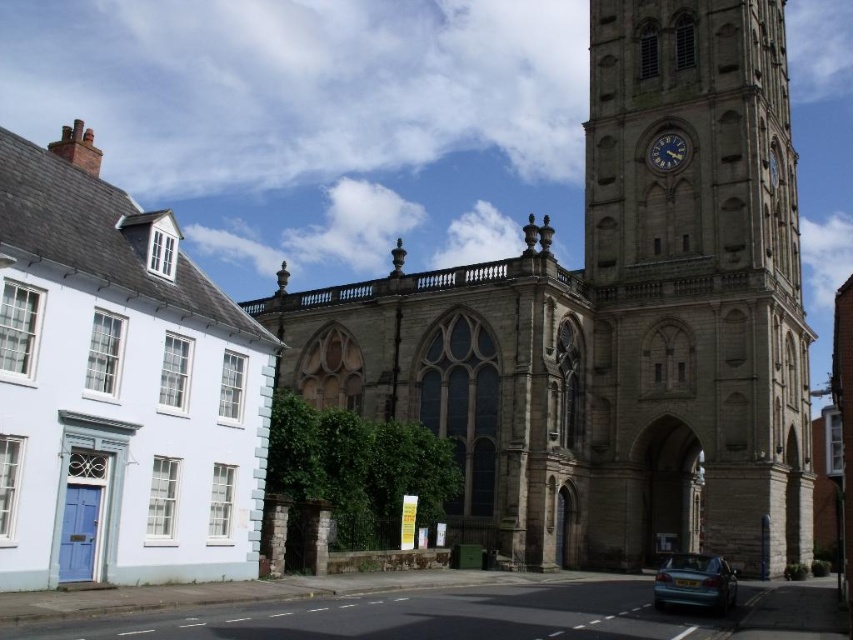
Question: Which point is closer to the camera?

Choices:
 (A) (798, 472)
 (B) (670, 563)
 (C) (97, 314)
 (D) (666, 154)

Answer: (C)

Question: Is stone church at center above teal matte car at lower right?

Choices:
 (A) no
 (B) yes

Answer: (B)

Question: Which object is positioned closest to the stone church at center?

Choices:
 (A) metallic clock face at upper center
 (B) teal matte car at lower right
 (C) light blue stone church at left
 (D) stone clock tower at right

Answer: (D)

Question: Is stone church at center closer to the viewer compared to metallic clock face at upper center?

Choices:
 (A) yes
 (B) no

Answer: (A)

Question: Is stone church at center to the left of light blue stone church at left from the viewer's perspective?

Choices:
 (A) no
 (B) yes

Answer: (A)

Question: Estimate the real-world distances between objects in this image. Which object is farther from the stone church at center?

Choices:
 (A) teal matte car at lower right
 (B) stone clock tower at right
 (C) metallic clock face at upper center

Answer: (A)